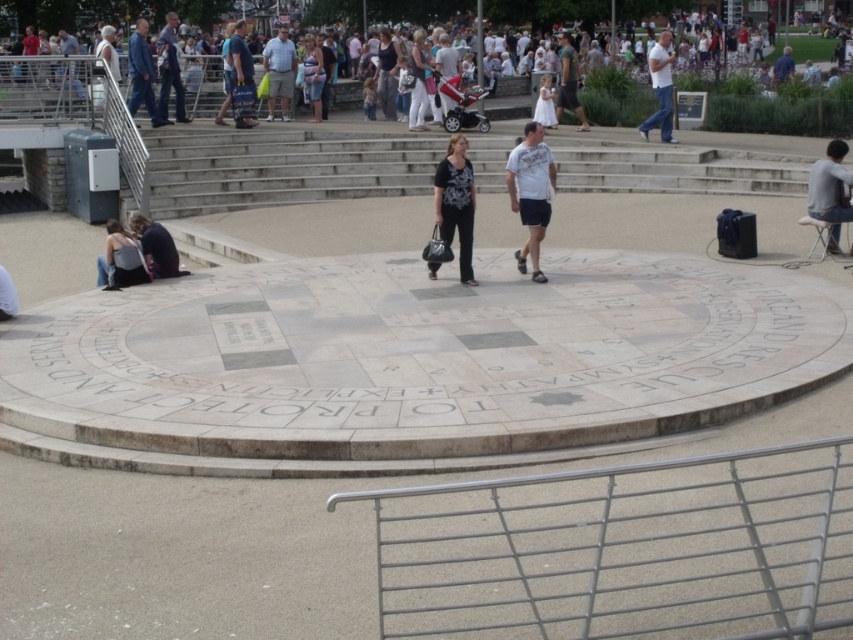
Question: Based on their relative distances, which object is farther from the matte black dress at center?

Choices:
 (A) blue denim jacket at upper left
 (B) dark blue jeans at upper left

Answer: (B)

Question: Does gray fabric shirt at upper right appear on the left side of white matte stone at lower left?

Choices:
 (A) no
 (B) yes

Answer: (A)

Question: Which point is farther from the camera taking this photo?

Choices:
 (A) (666, 40)
 (B) (566, 49)
 (C) (160, 56)

Answer: (B)

Question: Considering the relative positions of dark gray shorts at center and white matte stone at lower left in the image provided, where is dark gray shorts at center located with respect to white matte stone at lower left?

Choices:
 (A) above
 (B) below

Answer: (A)

Question: Considering the real-world distances, which object is closest to the light blue denim shorts at center?

Choices:
 (A) white cotton dress at upper center
 (B) dark blue jeans at lower left
 (C) gray fabric shirt at upper right

Answer: (B)

Question: Is matte black dress at center thinner than light blue denim shorts at center?

Choices:
 (A) yes
 (B) no

Answer: (A)